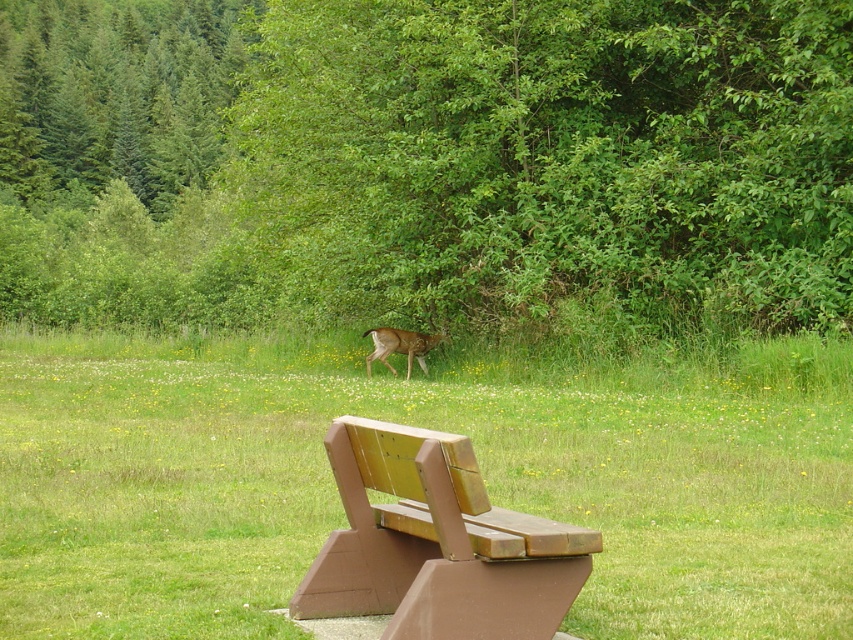
Is green leafy tree at center to the left of brown wood bench at lower center from the viewer's perspective?

Indeed, green leafy tree at center is positioned on the left side of brown wood bench at lower center.

Between green leafy tree at center and brown wood bench at lower center, which one appears on the left side from the viewer's perspective?

From the viewer's perspective, green leafy tree at center appears more on the left side.

Locate an element on the screen. This screenshot has width=853, height=640. green leafy tree at center is located at coordinates (428, 164).

This screenshot has width=853, height=640. What are the coordinates of `green leafy tree at center` in the screenshot? It's located at (428, 164).

Between green grass at center and brown fur deer at center, which one has less height?

With less height is brown fur deer at center.

Looking at this image, which is below, green grass at center or brown fur deer at center?

Positioned lower is green grass at center.

Identify the location of green grass at center. The height and width of the screenshot is (640, 853). (431, 428).

This screenshot has height=640, width=853. Identify the location of green grass at center. (431, 428).

Who is more distant from viewer, (65, 372) or (369, 506)?

Point (65, 372)

Is point (848, 436) positioned in front of point (527, 621)?

No, (848, 436) is further to viewer.

Find the location of a particular element. This screenshot has width=853, height=640. green grass at center is located at coordinates (431, 428).